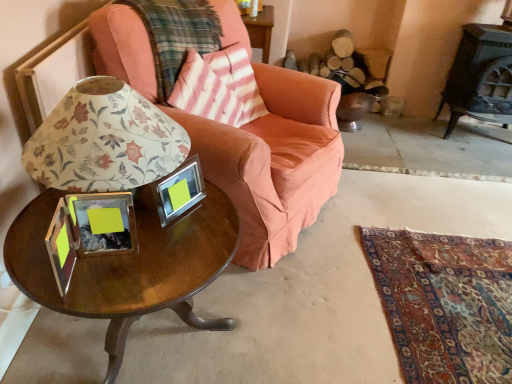
Question: From the image's perspective, is shiny brown wood coffee table at lower left located above or below pink striped fabric pillow at upper center?

Choices:
 (A) below
 (B) above

Answer: (A)

Question: Considering the positions of shiny brown wood coffee table at lower left and pink striped fabric pillow at upper center in the image, is shiny brown wood coffee table at lower left taller or shorter than pink striped fabric pillow at upper center?

Choices:
 (A) tall
 (B) short

Answer: (A)

Question: Based on their relative distances, which object is nearer to the velvet orange swivel chair at center?

Choices:
 (A) floral paper lampshade at center
 (B) pink striped fabric pillow at upper center
 (C) plaid fabric cushion at upper left
 (D) shiny brown wood coffee table at lower left
 (E) matte pink fabric chair at center

Answer: (B)

Question: Which object is the closest to the clear glass picture frame at center?

Choices:
 (A) shiny brown wood coffee table at lower left
 (B) velvet orange swivel chair at center
 (C) plaid fabric cushion at upper left
 (D) pink striped fabric pillow at upper center
 (E) matte pink fabric chair at center

Answer: (A)